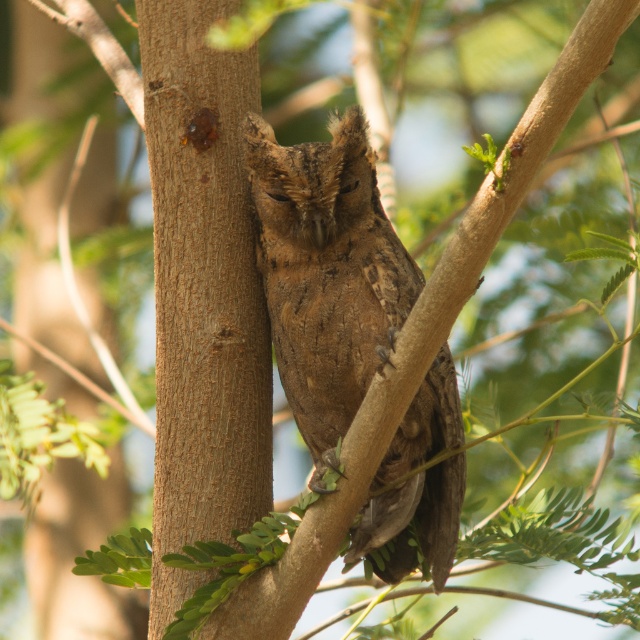
Question: Can you confirm if brown rough tree trunk at center is positioned below brown feathered owl at center?

Choices:
 (A) yes
 (B) no

Answer: (B)

Question: Where is brown rough tree trunk at center located in relation to brown feathered owl at center in the image?

Choices:
 (A) above
 (B) below

Answer: (A)

Question: Does brown rough tree trunk at center come behind brown feathered owl at center?

Choices:
 (A) no
 (B) yes

Answer: (B)

Question: Which point is closer to the camera?

Choices:
 (A) brown rough tree trunk at center
 (B) brown feathered owl at center

Answer: (B)